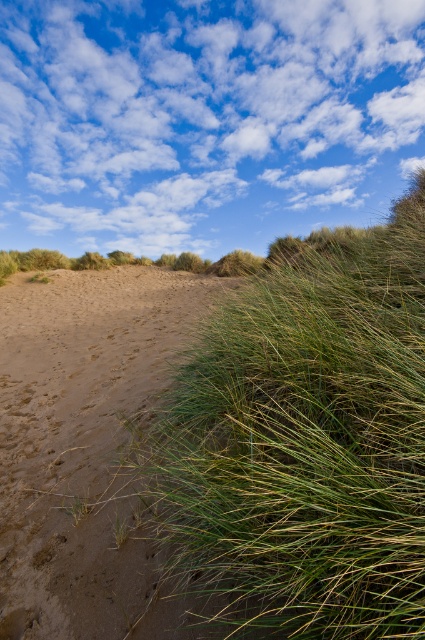
You are standing at the center of the sandy dune and want to walk towards the green grassy area. Which direction should you head to reach the green grassy at center?

The green grassy at center is located at coordinates point (306,440), so you should head towards the direction of the point to reach it.

In the scene shown: You are a hiker who needs to cross from the brown sandy at left to the green grassy at center. Given that your backpack weighs 20 kg, can you safely make the crossing without slipping? The maximum safe distance for a 20 kg backpack is 5 meters.

The distance between the brown sandy at left and green grassy at center is 5.78 meters, which exceeds the maximum safe distance of 5 meters for a 20 kg backpack. Therefore, it is not safe to cross.

You are standing in the landscape and want to walk towards the green grassy at center and the brown sandy at left. Which area will you step into first?

You will step into the green grassy at center first because it is closer to you than the brown sandy at left.